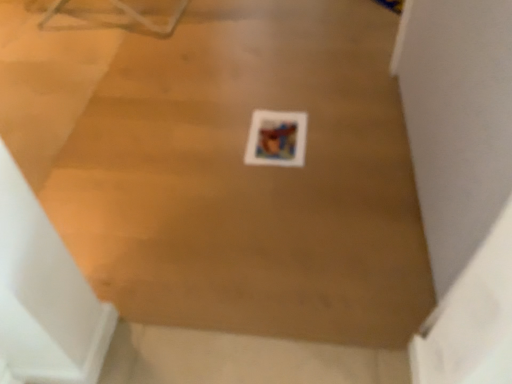
Locate an element on the screen. This screenshot has width=512, height=384. free spot above matte paper print at center (from a real-world perspective) is located at coordinates (278, 131).